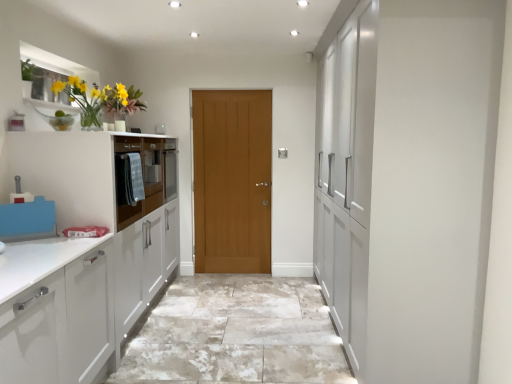
What are the coordinates of `free space above light brown wooden door at center (from a real-world perspective)` in the screenshot? It's located at (231, 89).